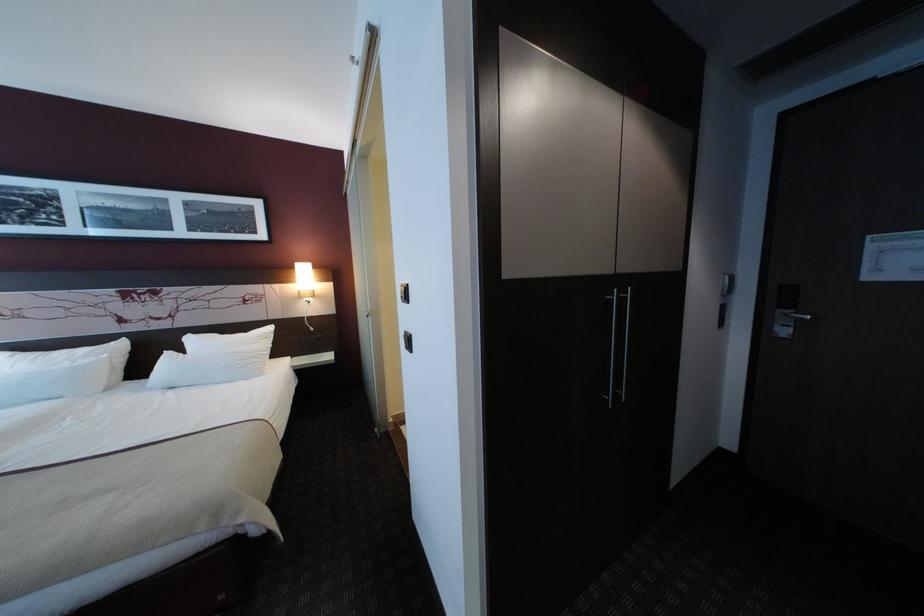
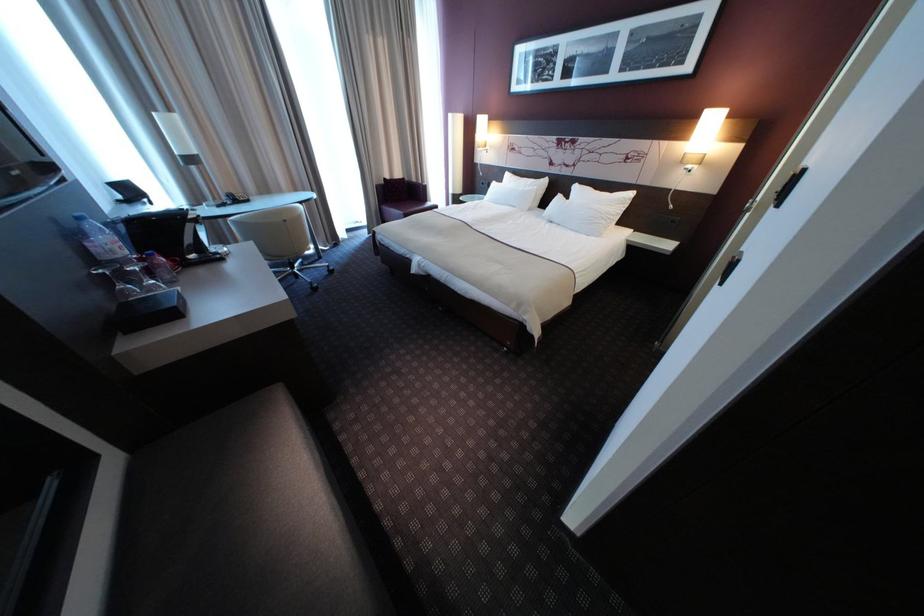
First-person continuous shooting, in which direction is the camera rotating?

The camera's rotation is toward left-down.